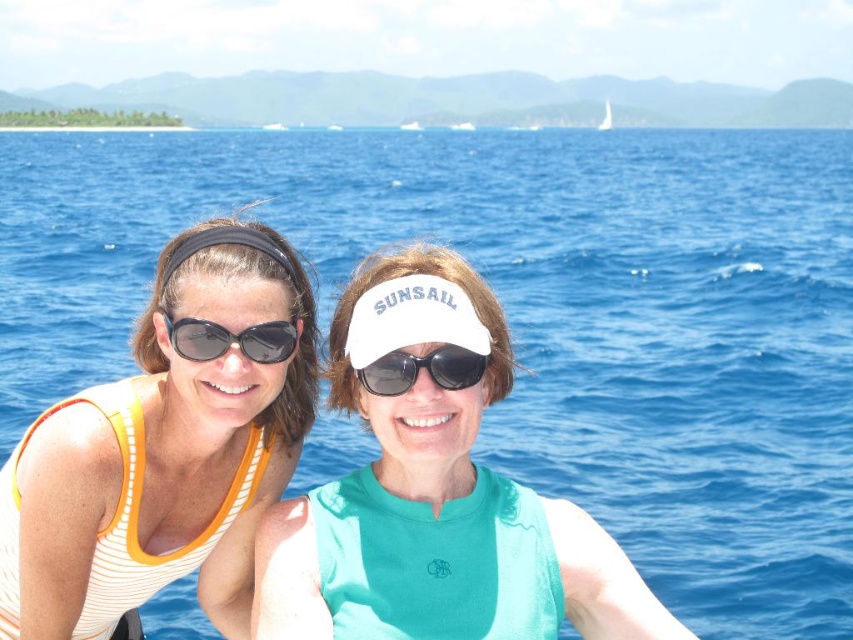
Question: Does teal fabric visor at center have a larger size compared to matte black sunglasses at center?

Choices:
 (A) yes
 (B) no

Answer: (B)

Question: Is matte black sunglasses at center positioned behind black matte sunglasses at center?

Choices:
 (A) no
 (B) yes

Answer: (A)

Question: Which object is closer to the camera taking this photo?

Choices:
 (A) black matte sunglasses at center
 (B) white striped tank top at left
 (C) teal fabric visor at center
 (D) matte black sunglasses at center

Answer: (C)

Question: Is white striped tank top at left closer to the viewer compared to black matte sunglasses at center?

Choices:
 (A) yes
 (B) no

Answer: (B)

Question: Which object is positioned farthest from the white striped tank top at left?

Choices:
 (A) matte black sunglasses at center
 (B) teal fabric visor at center
 (C) black matte sunglasses at center

Answer: (B)

Question: Which object is positioned closest to the black matte sunglasses at center?

Choices:
 (A) teal fabric visor at center
 (B) matte black sunglasses at center
 (C) white striped tank top at left

Answer: (B)